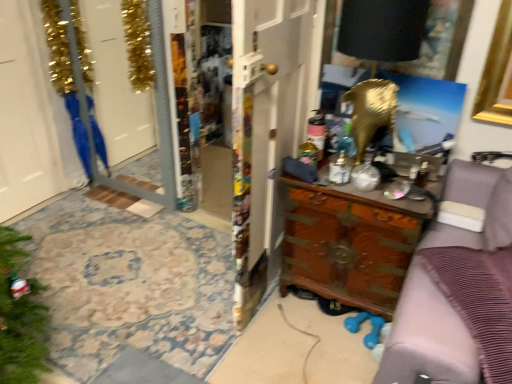
Question: From the image's perspective, is blue fabric robe at left above or below brown wood dresser at right?

Choices:
 (A) below
 (B) above

Answer: (B)

Question: Is point (79, 158) positioned closer to the camera than point (428, 349)?

Choices:
 (A) farther
 (B) closer

Answer: (A)

Question: Estimate the real-world distances between objects in this image. Which object is farther from the brown wood dresser at right?

Choices:
 (A) wooden door at center, which is counted as the 2th door, starting from the left
 (B) clear glass screen door at left
 (C) blue fabric robe at left
 (D) white glossy door at left, which is counted as the 1th door, starting from the left
 (E) wooden carved dresser at center

Answer: (D)

Question: Which object is the farthest from the wooden door at center, which is counted as the 2th door, starting from the left?

Choices:
 (A) blue fabric robe at left
 (B) brown wood dresser at right
 (C) clear glass screen door at left
 (D) wooden carved dresser at center
 (E) white glossy door at left, which is counted as the 1th door, starting from the left

Answer: (E)